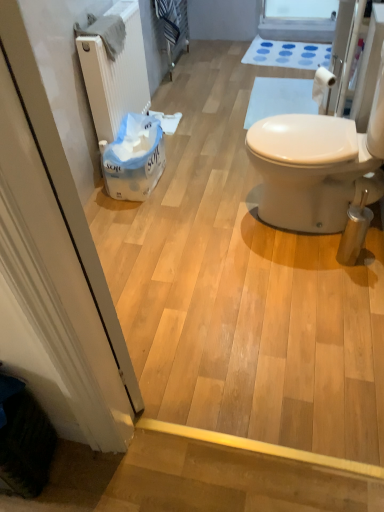
Question: In which direction should I rotate to look at transparent plastic window screen at upper center?

Choices:
 (A) right
 (B) left

Answer: (A)

Question: From a real-world perspective, does white rubber bath mat at upper center stand above white matte toilet paper at upper right, which is counted as the 1th toilet paper, starting from the front?

Choices:
 (A) yes
 (B) no

Answer: (B)

Question: Is white rubber bath mat at upper center outside white matte toilet paper at upper right, positioned as the second toilet paper in left-to-right order?

Choices:
 (A) no
 (B) yes

Answer: (B)

Question: From the image's perspective, is white rubber bath mat at upper center over white matte toilet paper at upper right, the first toilet paper when ordered from right to left?

Choices:
 (A) yes
 (B) no

Answer: (A)

Question: Is white rubber bath mat at upper center taller than white matte toilet paper at upper right, which is counted as the 1th toilet paper, starting from the front?

Choices:
 (A) yes
 (B) no

Answer: (B)

Question: Would you say white matte toilet paper at upper right, positioned as the second toilet paper in left-to-right order, is part of white rubber bath mat at upper center's contents?

Choices:
 (A) yes
 (B) no

Answer: (B)

Question: Considering the relative sizes of white rubber bath mat at upper center and white matte toilet paper at upper right, positioned as the second toilet paper in left-to-right order, in the image provided, is white rubber bath mat at upper center thinner than white matte toilet paper at upper right, positioned as the second toilet paper in left-to-right order,?

Choices:
 (A) yes
 (B) no

Answer: (B)

Question: Does white matte screen door at left have a greater width compared to white matte toilet paper at upper right, positioned as the second toilet paper in left-to-right order?

Choices:
 (A) no
 (B) yes

Answer: (B)

Question: Is white matte screen door at left to the left of white matte toilet paper at upper right, positioned as the second toilet paper in left-to-right order, from the viewer's perspective?

Choices:
 (A) no
 (B) yes

Answer: (B)

Question: Does white matte screen door at left have a greater height compared to white matte toilet paper at upper right, which is counted as the 1th toilet paper, starting from the front?

Choices:
 (A) yes
 (B) no

Answer: (A)

Question: Could you tell me if white matte screen door at left is turned towards white matte toilet paper at upper right, positioned as the second toilet paper in left-to-right order?

Choices:
 (A) no
 (B) yes

Answer: (A)

Question: Is white matte screen door at left turned away from white matte toilet paper at upper right, marked as the 2th toilet paper in a back-to-front arrangement?

Choices:
 (A) yes
 (B) no

Answer: (B)

Question: From a real-world perspective, is white matte screen door at left on top of white matte toilet paper at upper right, which is counted as the 1th toilet paper, starting from the front?

Choices:
 (A) no
 (B) yes

Answer: (B)

Question: Can you confirm if white rubber bath mat at upper center is bigger than transparent plastic window screen at upper center?

Choices:
 (A) yes
 (B) no

Answer: (B)